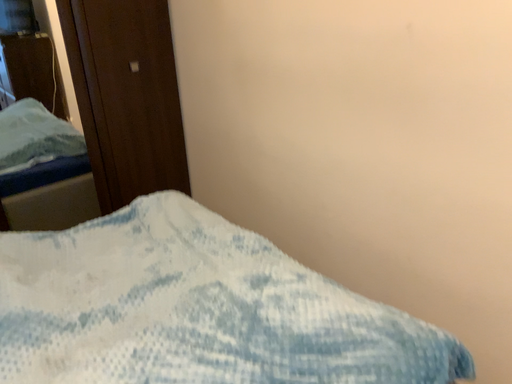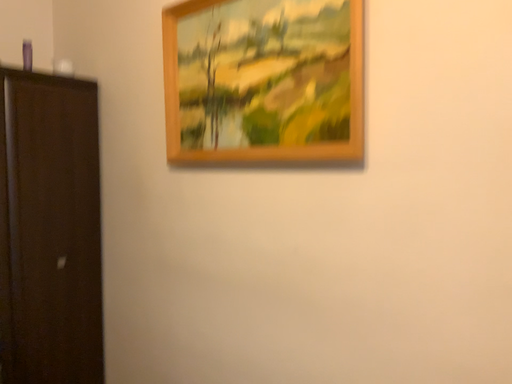
Question: How did the camera likely rotate when shooting the video?

Choices:
 (A) rotated upward
 (B) rotated downward

Answer: (A)